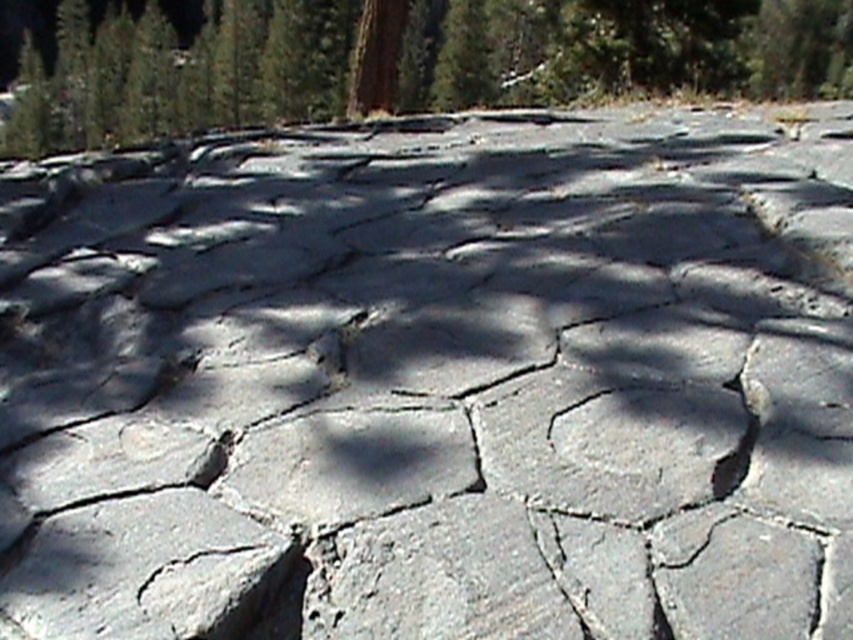
Is green textured tree at center to the right of gray rough stone at lower left from the viewer's perspective?

In fact, green textured tree at center is to the left of gray rough stone at lower left.

Who is higher up, green textured tree at center or gray rough stone at lower left?

Positioned higher is green textured tree at center.

The height and width of the screenshot is (640, 853). Identify the location of green textured tree at center. point(405,60).